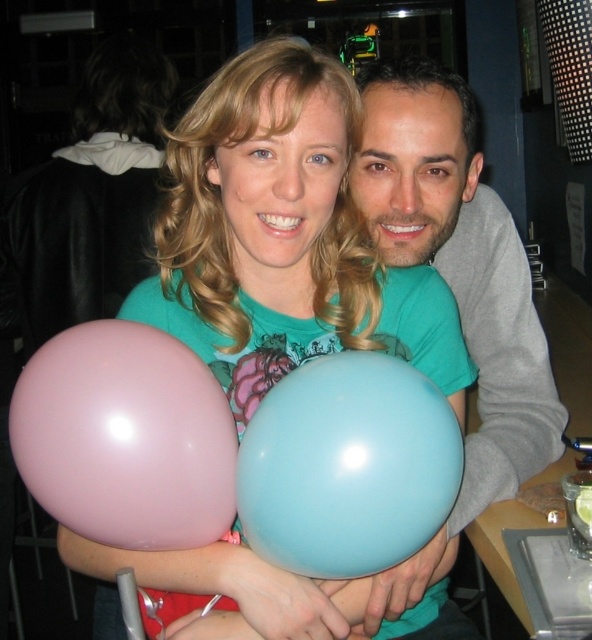
Question: Estimate the real-world distances between objects in this image. Which object is farther from the light blue rubber balloon at center?

Choices:
 (A) pink rubber balloon at left
 (B) matte rubber balloons at center

Answer: (B)

Question: Does matte rubber balloons at center appear under pink rubber balloon at left?

Choices:
 (A) no
 (B) yes

Answer: (A)

Question: Is matte rubber balloons at center to the right of light blue rubber balloon at center from the viewer's perspective?

Choices:
 (A) no
 (B) yes

Answer: (A)

Question: Which of these objects is positioned farthest from the matte rubber balloons at center?

Choices:
 (A) light blue rubber balloon at center
 (B) pink rubber balloon at left

Answer: (A)

Question: Which object is positioned farthest from the light blue rubber balloon at center?

Choices:
 (A) pink rubber balloon at left
 (B) matte rubber balloons at center

Answer: (B)

Question: Can you confirm if matte rubber balloons at center is positioned below light blue rubber balloon at center?

Choices:
 (A) no
 (B) yes

Answer: (A)